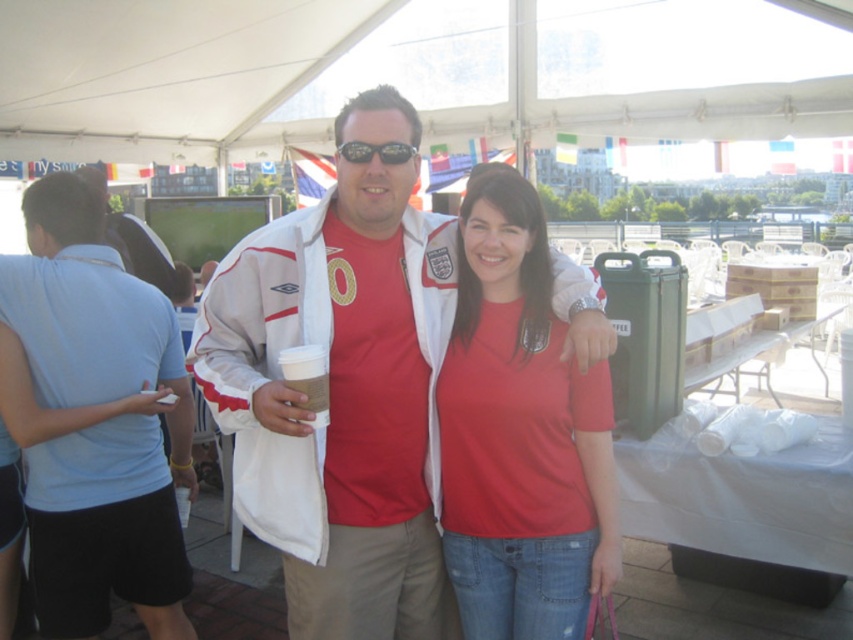
Between white matte jacket at center and matte white jacket at center, which one has more height?

With more height is matte white jacket at center.

Which is behind, point (270, 330) or point (114, 348)?

The point (114, 348) is more distant.

This screenshot has width=853, height=640. What are the coordinates of `white matte jacket at center` in the screenshot? It's located at (341, 390).

Is white matte jacket at center to the right of matte red t-shirt at center from the viewer's perspective?

No, white matte jacket at center is not to the right of matte red t-shirt at center.

This screenshot has width=853, height=640. I want to click on white matte jacket at center, so click(341, 390).

Based on the photo, can you confirm if matte red t-shirt at center is thinner than black plastic goggles at center?

In fact, matte red t-shirt at center might be wider than black plastic goggles at center.

Does matte red t-shirt at center have a smaller size compared to black plastic goggles at center?

No, matte red t-shirt at center is not smaller than black plastic goggles at center.

Is point (544, 378) closer to viewer compared to point (341, 145)?

That is False.

Where is `matte red t-shirt at center`? This screenshot has width=853, height=640. matte red t-shirt at center is located at coordinates (521, 435).